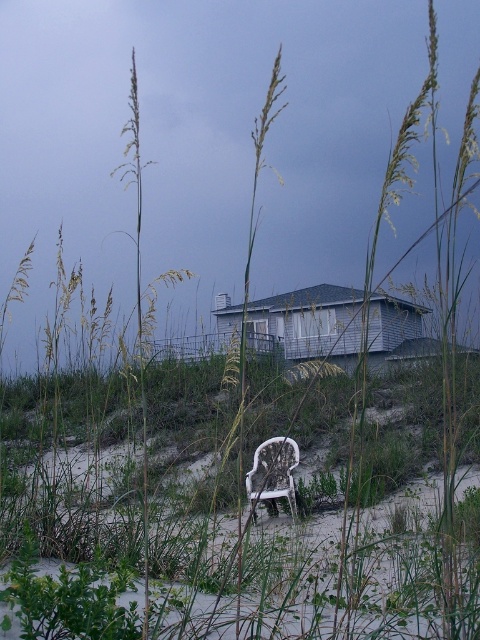
How far apart are white wood house at center and white plastic chair at lower center?

28.84 feet

Between white wood house at center and white plastic chair at lower center, which one has less height?

white plastic chair at lower center is shorter.

Which is in front, point (408, 321) or point (292, 451)?

Point (292, 451) is more forward.

What are the coordinates of `white wood house at center` in the screenshot? It's located at (310, 323).

This screenshot has width=480, height=640. In order to click on green grass at center in this screenshot , I will do `click(367, 540)`.

Can you confirm if green grass at center is positioned to the left of white wood house at center?

Correct, you'll find green grass at center to the left of white wood house at center.

Locate an element on the screen. Image resolution: width=480 pixels, height=640 pixels. green grass at center is located at coordinates (367, 540).

The height and width of the screenshot is (640, 480). Find the location of `green grass at center`. green grass at center is located at coordinates (367, 540).

Consider the image. Can you confirm if green grass at center is thinner than white plastic chair at lower center?

No, green grass at center is not thinner than white plastic chair at lower center.

Who is shorter, green grass at center or white plastic chair at lower center?

white plastic chair at lower center

Is point (441, 518) behind point (263, 460)?

No, (441, 518) is closer to viewer.

Locate an element on the screen. This screenshot has height=640, width=480. green grass at center is located at coordinates (367, 540).